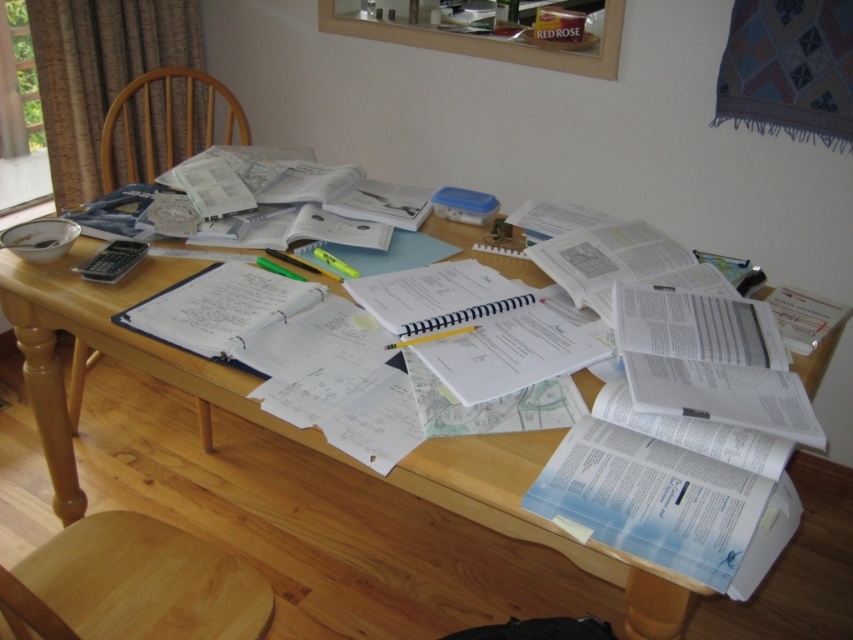
Question: Among these points, which one is farthest from the camera?

Choices:
 (A) (173, 68)
 (B) (100, 545)

Answer: (A)

Question: Which object is farther from the camera taking this photo?

Choices:
 (A) wooden chair at left
 (B) light brown wood chair at lower left

Answer: (A)

Question: Is light brown wood chair at lower left thinner than wooden chair at left?

Choices:
 (A) yes
 (B) no

Answer: (A)

Question: Is light brown wood chair at lower left wider than wooden chair at left?

Choices:
 (A) yes
 (B) no

Answer: (B)

Question: Which of the following is the closest to the observer?

Choices:
 (A) light brown wood chair at lower left
 (B) wooden chair at left

Answer: (A)

Question: Does light brown wood chair at lower left lie in front of wooden chair at left?

Choices:
 (A) yes
 (B) no

Answer: (A)